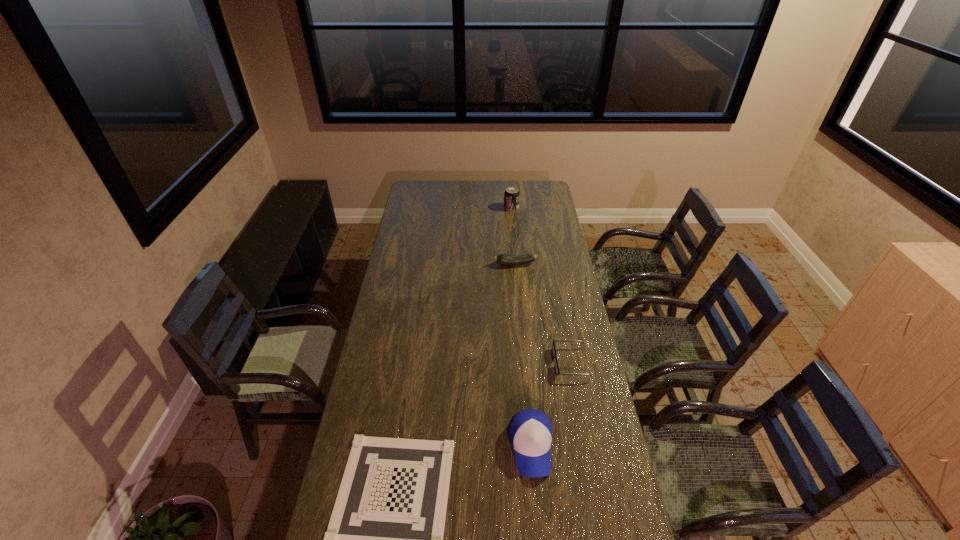
This screenshot has height=540, width=960. In order to click on free space located at the blossom end of the second farthest object in this screenshot , I will do `click(453, 264)`.

You are a GUI agent. You are given a task and a screenshot of the screen. Output one action in this format:
    pyautogui.click(x=<x>, y=<y>)
    Task: Click on the free space located at the blossom end of the second farthest object
    This screenshot has width=960, height=540.
    Given the screenshot: What is the action you would take?
    pyautogui.click(x=479, y=264)

At what (x,y) coordinates should I click in order to perform the action: click on vacant space located 0.320m on the front-facing side of the spectacles. Please return your answer as a coordinate pair (x, y). The image size is (960, 540). Looking at the image, I should click on (473, 362).

This screenshot has height=540, width=960. I want to click on free space located 0.050m on the front-facing side of the spectacles, so click(x=540, y=362).

Find the location of a particular element. vacant space located on the front-facing side of the spectacles is located at coordinates (483, 362).

Locate an element on the screen. zucchini situated at the right edge is located at coordinates (503, 259).

The image size is (960, 540). I want to click on spectacles positioned at the right edge, so click(557, 371).

This screenshot has height=540, width=960. I want to click on vacant space at the far edge, so click(461, 191).

At what (x,y) coordinates should I click in order to perform the action: click on free point at the left edge. Please return your answer as a coordinate pair (x, y). The width and height of the screenshot is (960, 540). Looking at the image, I should click on (421, 247).

In the image, there is a desktop. Where is `blank space at the right edge`? The width and height of the screenshot is (960, 540). blank space at the right edge is located at coordinates (540, 222).